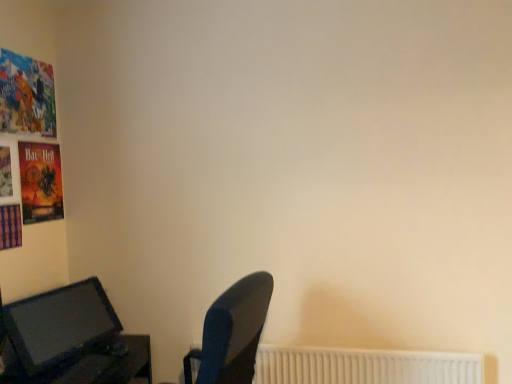
Question: From the image's perspective, relative to white plastic radiator at lower right, is matte black monitor at lower left above or below?

Choices:
 (A) below
 (B) above

Answer: (B)

Question: From their relative heights in the image, would you say matte black monitor at lower left is taller or shorter than white plastic radiator at lower right?

Choices:
 (A) short
 (B) tall

Answer: (B)

Question: Considering the relative positions of matte black monitor at lower left and white plastic radiator at lower right in the image provided, is matte black monitor at lower left to the left or to the right of white plastic radiator at lower right?

Choices:
 (A) left
 (B) right

Answer: (A)

Question: Do you think white plastic radiator at lower right is within matte black monitor at lower left, or outside of it?

Choices:
 (A) inside
 (B) outside

Answer: (B)

Question: From a real-world perspective, is white plastic radiator at lower right positioned above or below matte black monitor at lower left?

Choices:
 (A) above
 (B) below

Answer: (B)

Question: Is white plastic radiator at lower right taller or shorter than matte black monitor at lower left?

Choices:
 (A) tall
 (B) short

Answer: (B)

Question: From the image's perspective, is white plastic radiator at lower right above or below matte black monitor at lower left?

Choices:
 (A) below
 (B) above

Answer: (A)